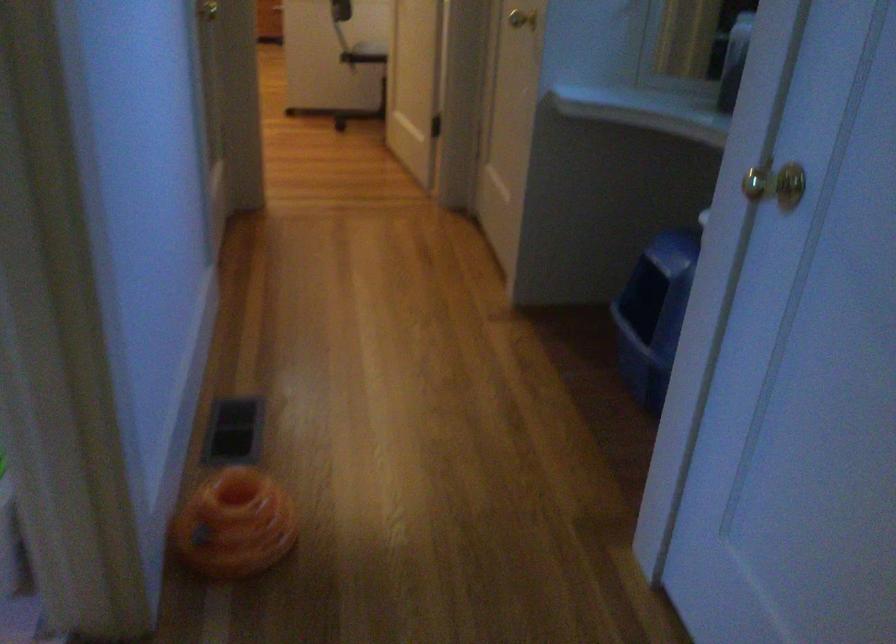
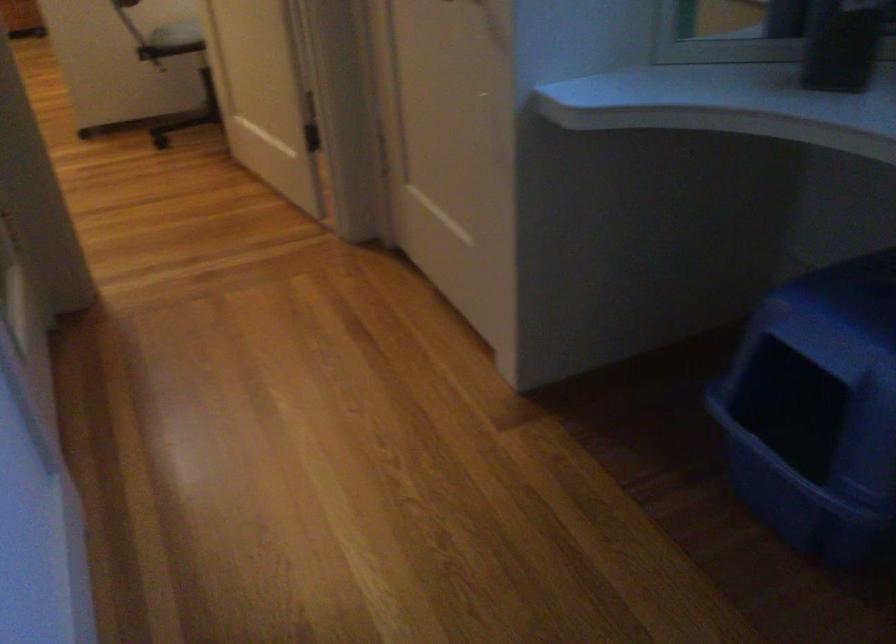
Question: The camera is either moving clockwise (left) or counter-clockwise (right) around the object. The first image is from the beginning of the video and the second image is from the end. Is the camera moving left or right when shooting the video?

Choices:
 (A) Left
 (B) Right

Answer: (A)